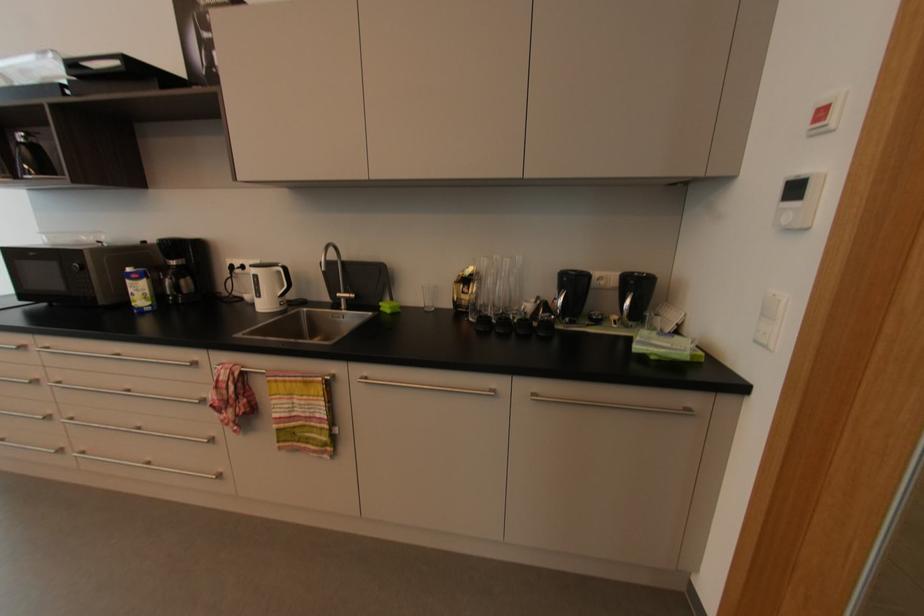
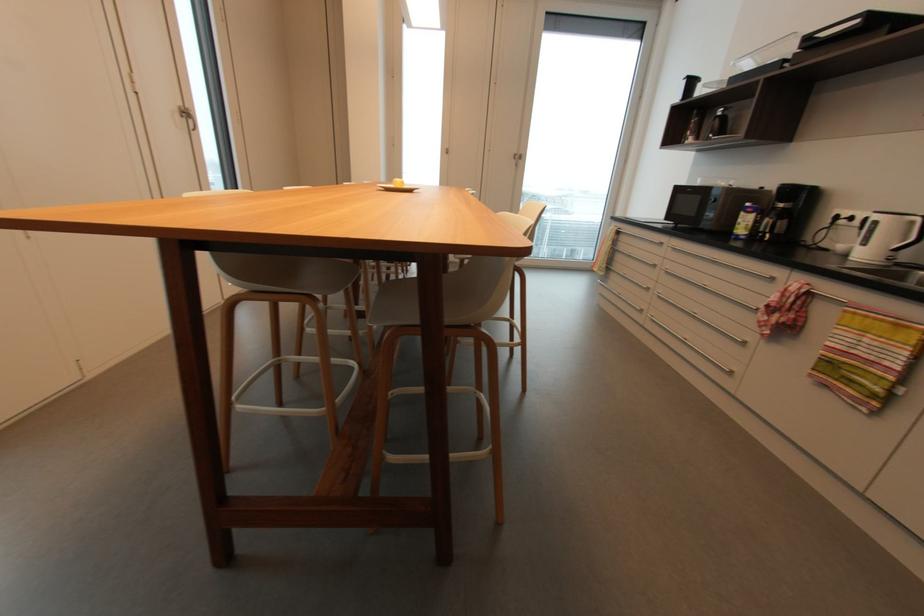
The point at (199, 363) is marked in the first image. Where is the corresponding point in the second image?

(775, 280)